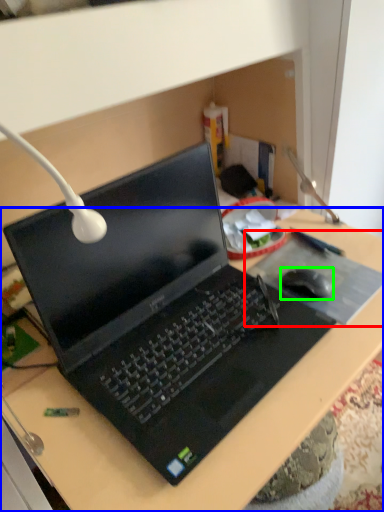
Question: Considering the real-world distances, which object is farthest from mousepad (highlighted by a red box)? desk (highlighted by a blue box) or mouse (highlighted by a green box)?

Choices:
 (A) desk
 (B) mouse

Answer: (A)